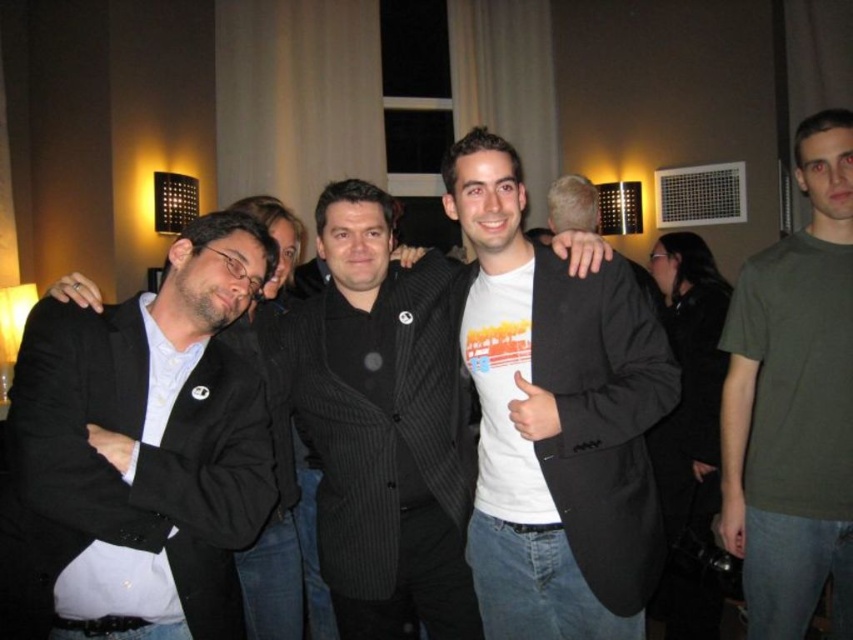
You are a photographer adjusting camera settings for a group photo. You notice the matte black blazer at left and the black pinstripe suit at center. Which clothing item is closer to the camera?

The matte black blazer at left is shorter than the black pinstripe suit at center, so it is closer to the camera.

Consider the image. You are standing in the room where the group photo was taken. You want to place a small decoration exactly at the point labeled as point (x=64, y=358). If your arm reaches 4.5 feet, can you reach that point without moving closer?

The point (x=64, y=358) is 5.10 feet away from the camera. Since your arm reaches only 4.5 feet, you cannot reach the point without moving closer.